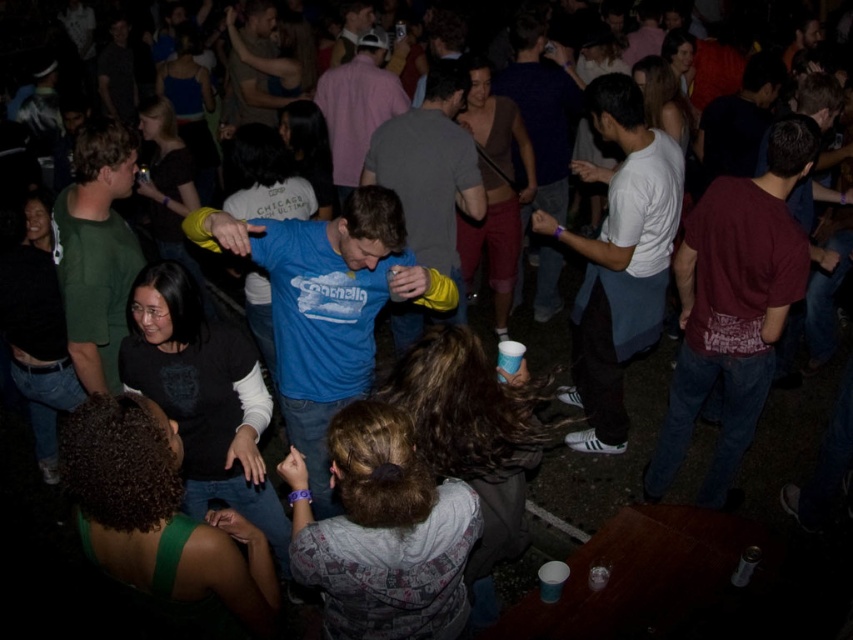
Question: Which of the following is the farthest from the observer?

Choices:
 (A) dark blue shirt at center
 (B) maroon t-shirt at right

Answer: (A)

Question: Where is blue t-shirt at center located in relation to pink cotton shirt at center in the image?

Choices:
 (A) right
 (B) left

Answer: (A)

Question: Among these objects, which one is farthest from the camera?

Choices:
 (A) white cotton shirt at center-right
 (B) maroon t-shirt at right
 (C) blue t-shirt at center
 (D) dark blue shirt at center

Answer: (D)

Question: From the image, what is the correct spatial relationship of maroon t-shirt at right in relation to pink cotton shirt at center?

Choices:
 (A) right
 (B) left

Answer: (A)

Question: Does blue cotton shirt at center have a smaller size compared to blue t-shirt at center?

Choices:
 (A) no
 (B) yes

Answer: (A)

Question: Which point is farther from the camera taking this photo?

Choices:
 (A) (120, 129)
 (B) (567, 99)
 (C) (361, 394)
 (D) (651, 212)

Answer: (B)